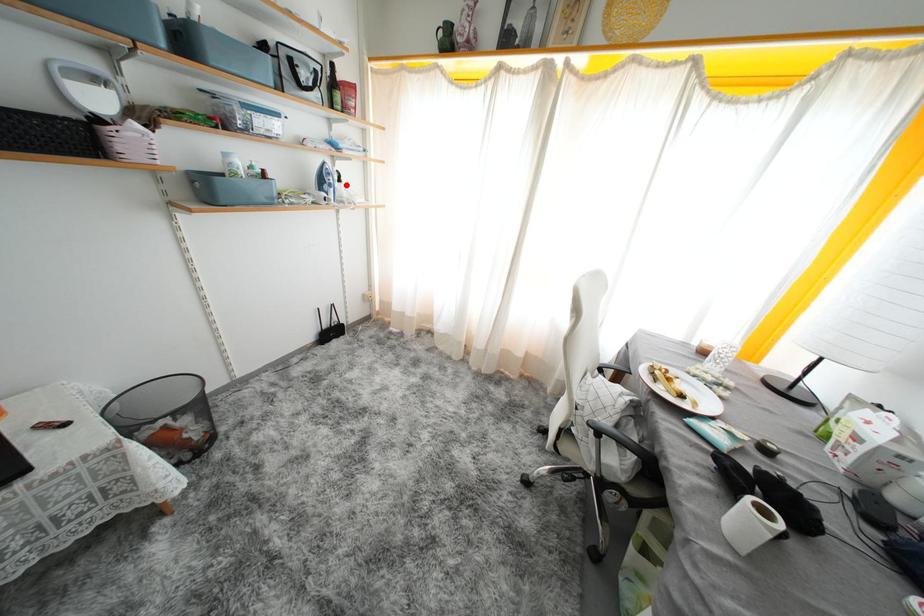
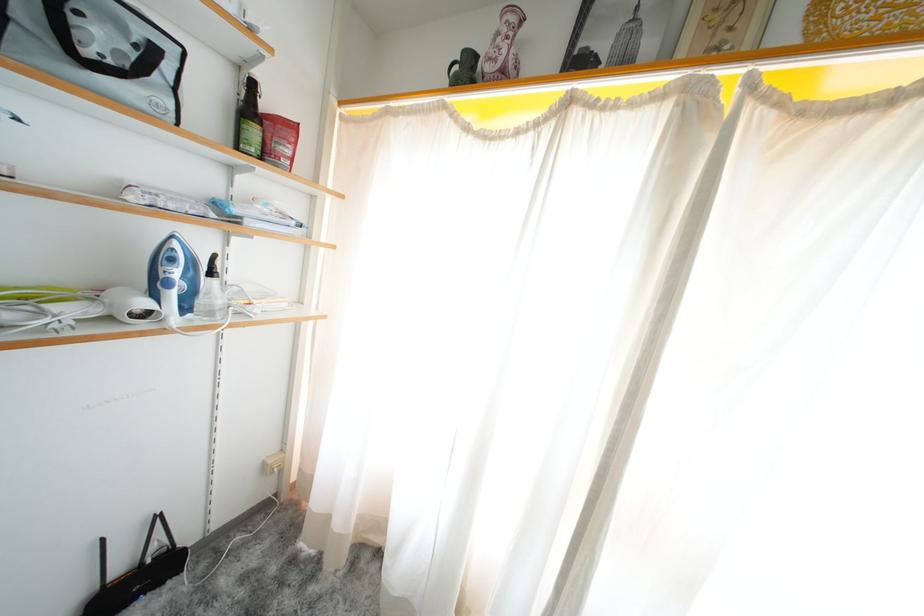
Question: I am providing you with two images of the same scene from different viewpoints. A red point is shown in image1. For the corresponding object point in image2, is it positioned nearer or farther from the camera?

Choices:
 (A) Nearer
 (B) Farther

Answer: (B)